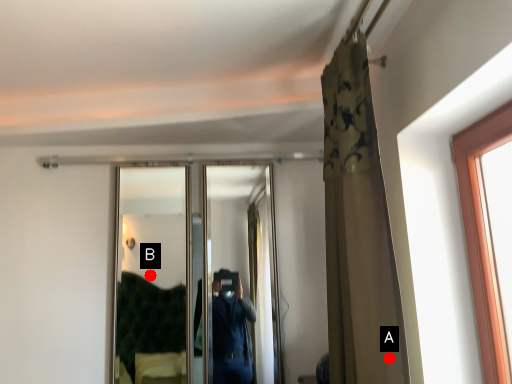
Question: Two points are circled on the image, labeled by A and B beside each circle. Which of the following is the farthest from the observer?

Choices:
 (A) A is further
 (B) B is further

Answer: (B)